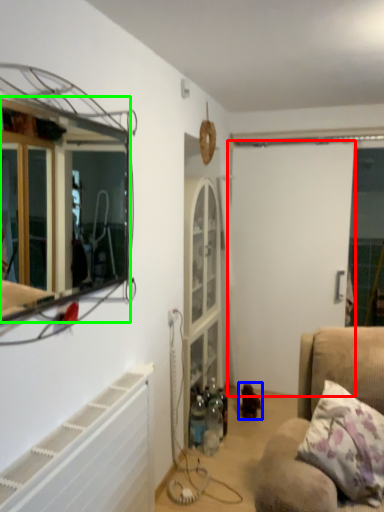
Question: Which object is positioned farthest from screen door (highlighted by a red box)? Select from toy (highlighted by a blue box) and mirror (highlighted by a green box).

Choices:
 (A) toy
 (B) mirror

Answer: (B)